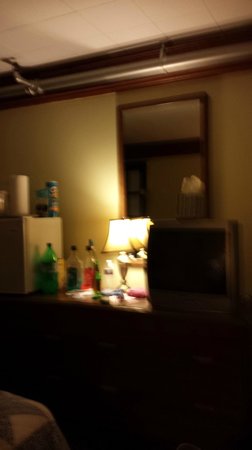
Locate an element on the screen. The image size is (252, 450). table is located at coordinates (131, 305).